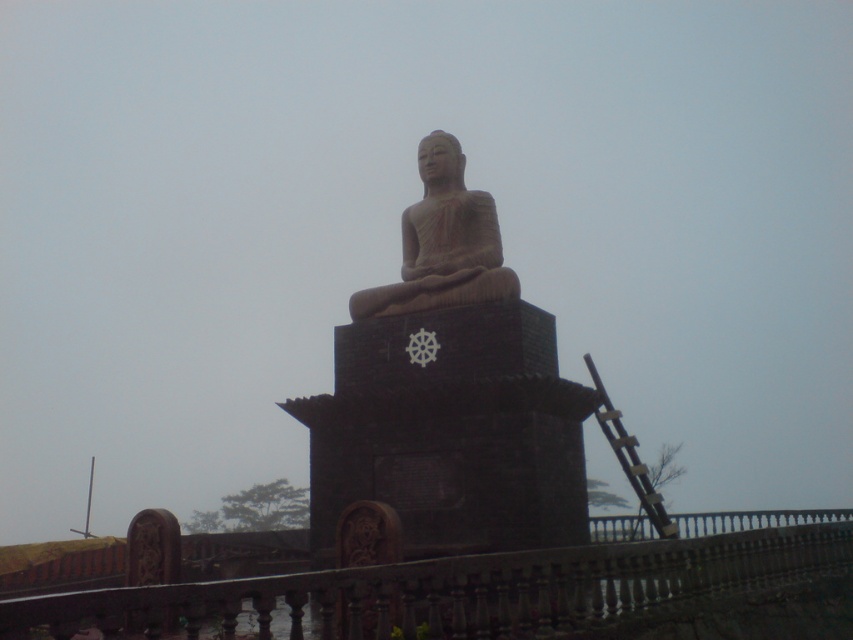
Which is below, brown wooden railing at lower center or brown stone statue at center?

brown wooden railing at lower center

Is point (601, 572) less distant than point (454, 152)?

Yes, point (601, 572) is in front of point (454, 152).

You are a GUI agent. You are given a task and a screenshot of the screen. Output one action in this format:
    pyautogui.click(x=<x>, y=<y>)
    Task: Click on the brown wooden railing at lower center
    Image resolution: width=853 pixels, height=640 pixels.
    Given the screenshot: What is the action you would take?
    pyautogui.click(x=456, y=589)